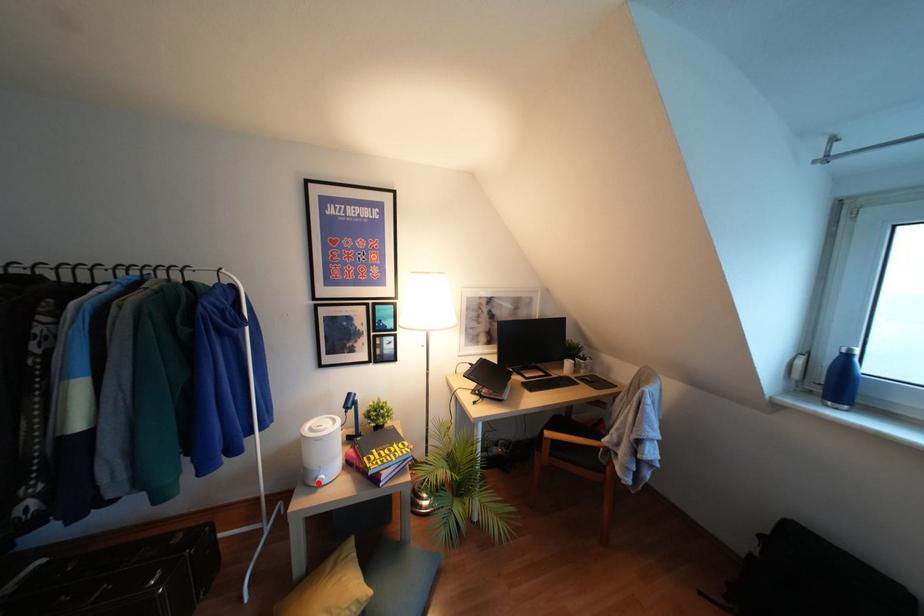
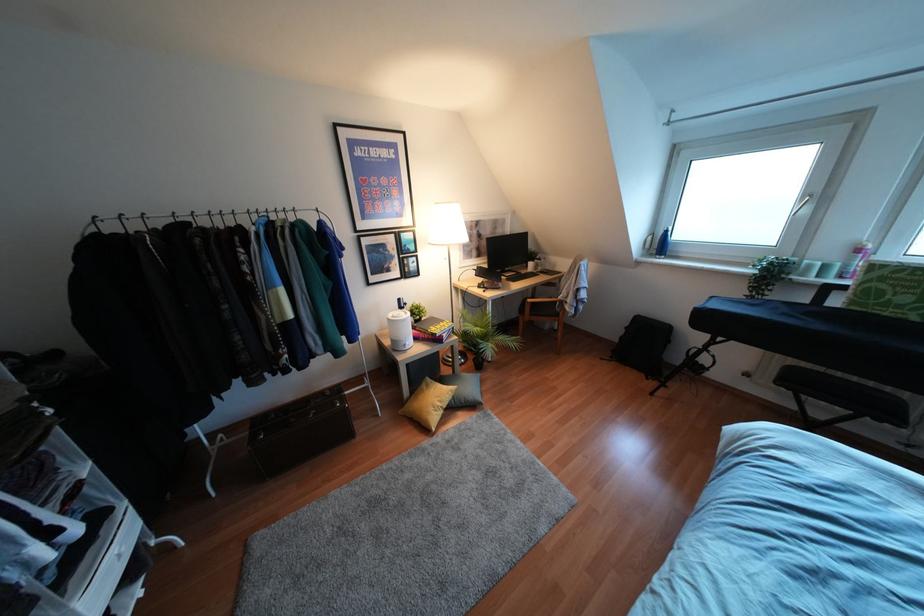
Locate, in the second image, the point that corresponds to the highlighted location in the first image.

(407, 347)